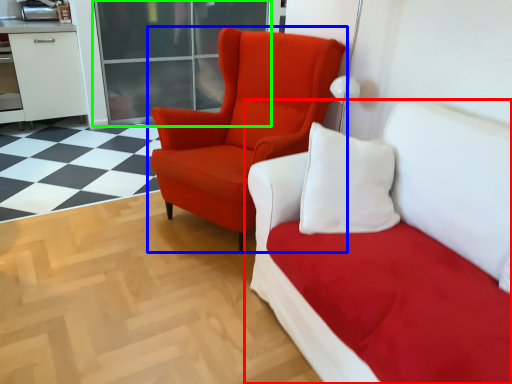
Question: Which is farther away from studio couch (highlighted by a red box)? chair (highlighted by a blue box) or glass door (highlighted by a green box)?

Choices:
 (A) chair
 (B) glass door

Answer: (B)